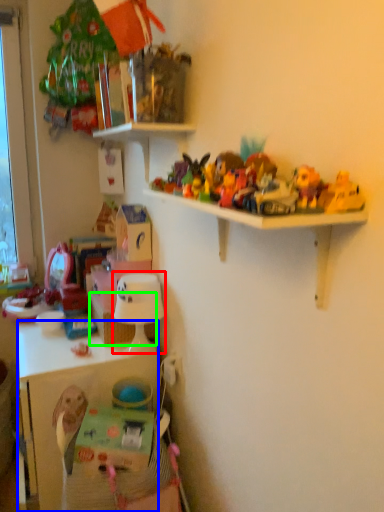
Question: Which is nearer to the lamp (highlighted by a red box)? cabinetry (highlighted by a blue box) or basket (highlighted by a green box).

Choices:
 (A) cabinetry
 (B) basket

Answer: (B)